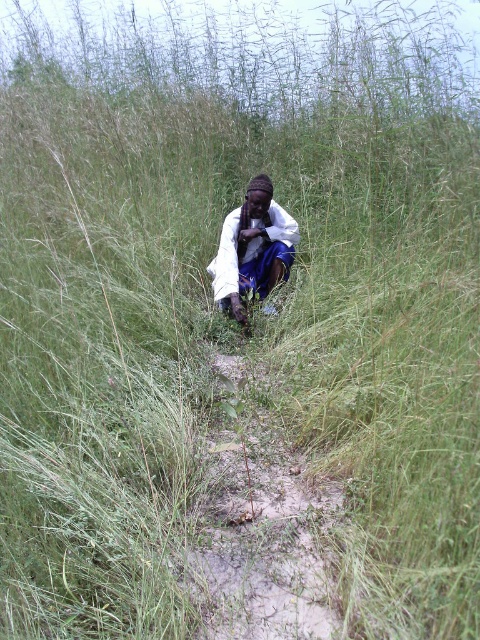
You are a hiker trying to navigate through the tall grasses. You notice a dirt path at center and a white matte shirt at center. Which one is lower to the ground?

The dirt path at center is lower to the ground compared to the white matte shirt at center.

You are planning to walk through the dirt path at center while wearing the white matte shirt at center. Considering their sizes, will the shirt be wider than the path?

The dirt path at center is narrower than the white matte shirt at center, so the shirt is wider than the path. Therefore, the shirt will be wider than the path.

You are a photographer trying to capture the scene from your current position. You notice two points marked in the image at coordinates point (278, 493) and point (233, 209). Which point would appear larger in your photo?

Point (278, 493) is closer to the camera than point (233, 209), so it would appear larger in the photo.